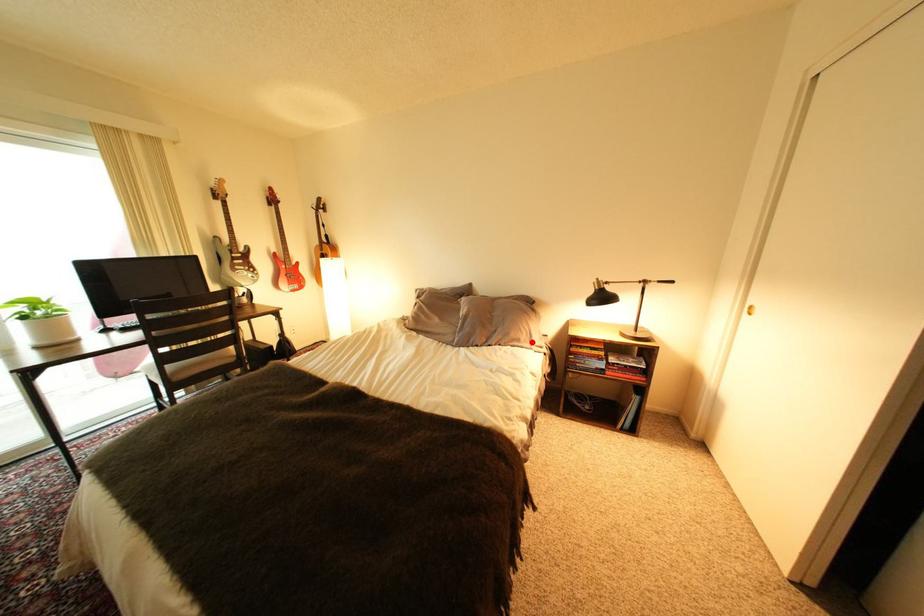
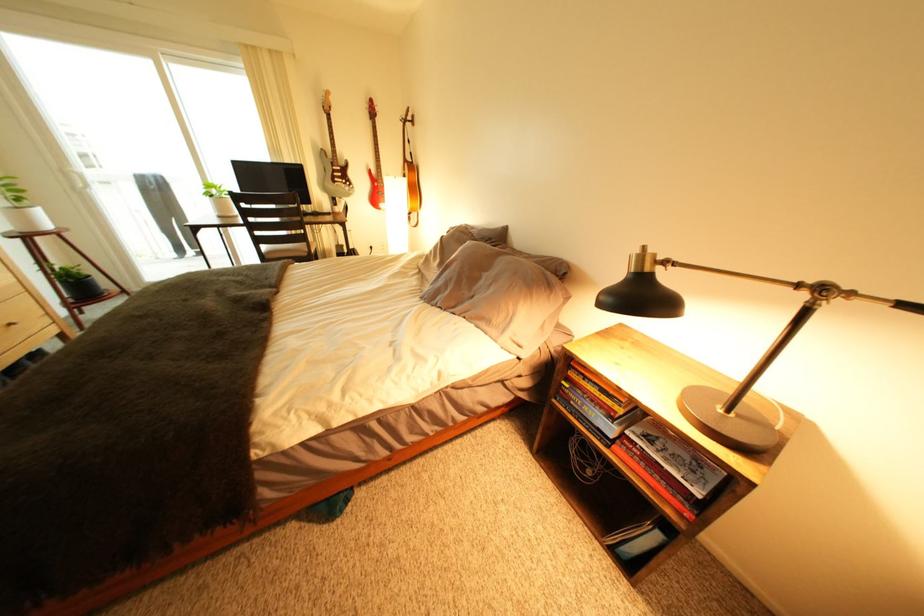
Locate, in the second image, the point that corresponds to the highlighted location in the first image.

(503, 323)